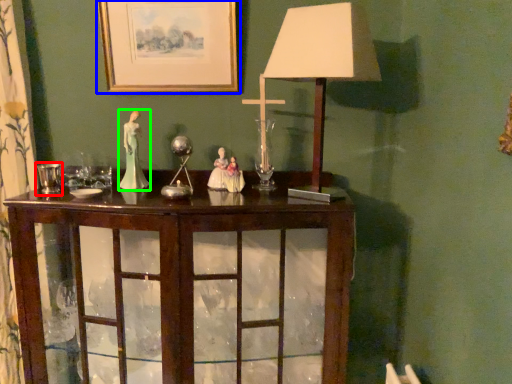
Question: Considering the real-world distances, which object is farthest from candle holder (highlighted by a red box)? picture frame (highlighted by a blue box) or person (highlighted by a green box)?

Choices:
 (A) picture frame
 (B) person

Answer: (A)